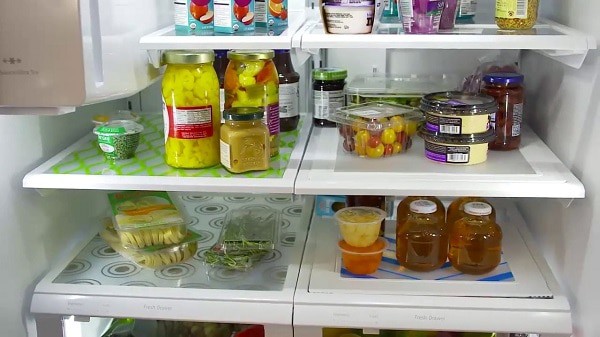
Find the location of a particular element. This screenshot has width=600, height=337. drawer is located at coordinates (119, 321), (317, 323).